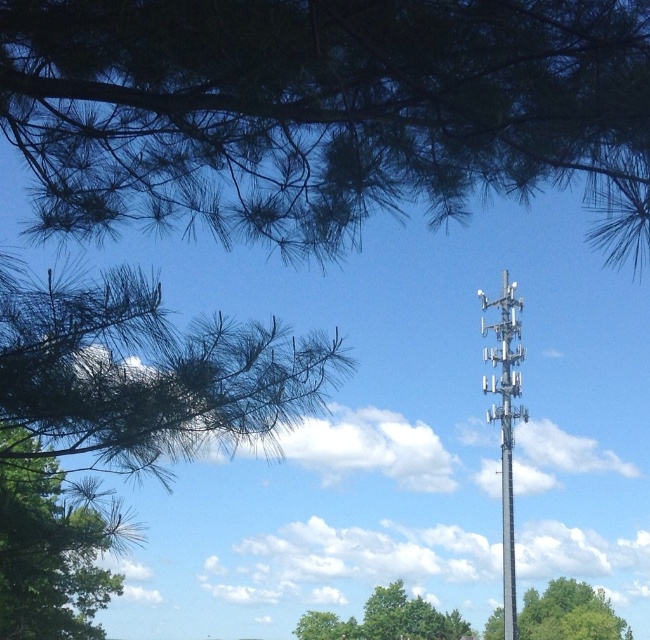
Is green needle-like branches at upper left behind green leafy tree at lower right?

No, green needle-like branches at upper left is closer to the viewer.

Between point (335, 52) and point (601, 614), which one is positioned behind?

Point (601, 614)

Where is `green needle-like branches at upper left`? green needle-like branches at upper left is located at coordinates (326, 112).

Is point (36, 451) in front of point (391, 625)?

Yes, point (36, 451) is closer to viewer.

Locate an element on the screen. Image resolution: width=650 pixels, height=640 pixels. green matte tree at upper left is located at coordinates click(x=52, y=547).

Locate an element on the screen. green matte tree at upper left is located at coordinates (52, 547).

Can you confirm if green needle-like branches at upper left is shorter than silver metallic pole at upper right?

In fact, green needle-like branches at upper left may be taller than silver metallic pole at upper right.

Which of these two, green needle-like branches at upper left or silver metallic pole at upper right, stands shorter?

silver metallic pole at upper right is shorter.

Is point (75, 172) closer to viewer compared to point (508, 497)?

Yes.

At what (x,y) coordinates should I click in order to perform the action: click on green needle-like branches at upper left. Please return your answer as a coordinate pair (x, y). Looking at the image, I should click on (326, 112).